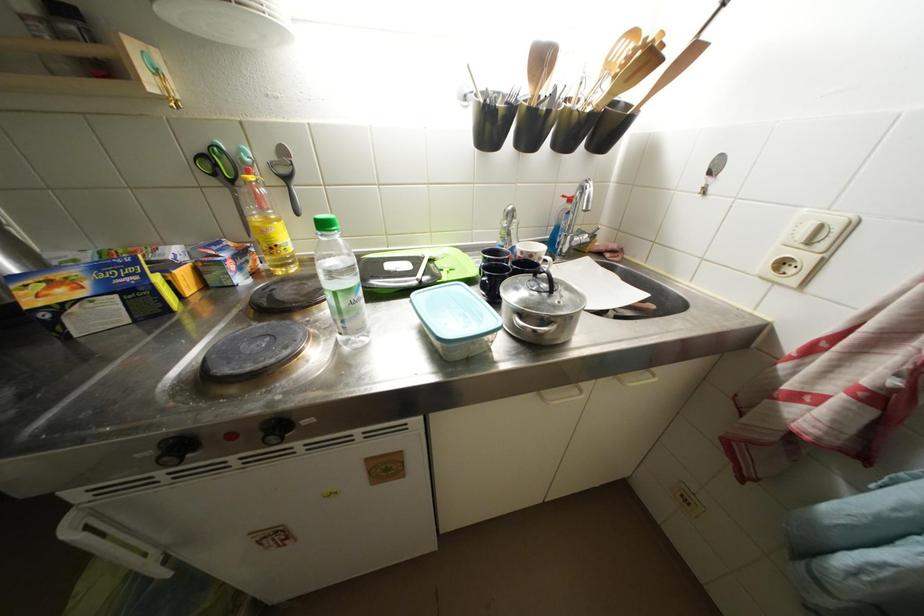
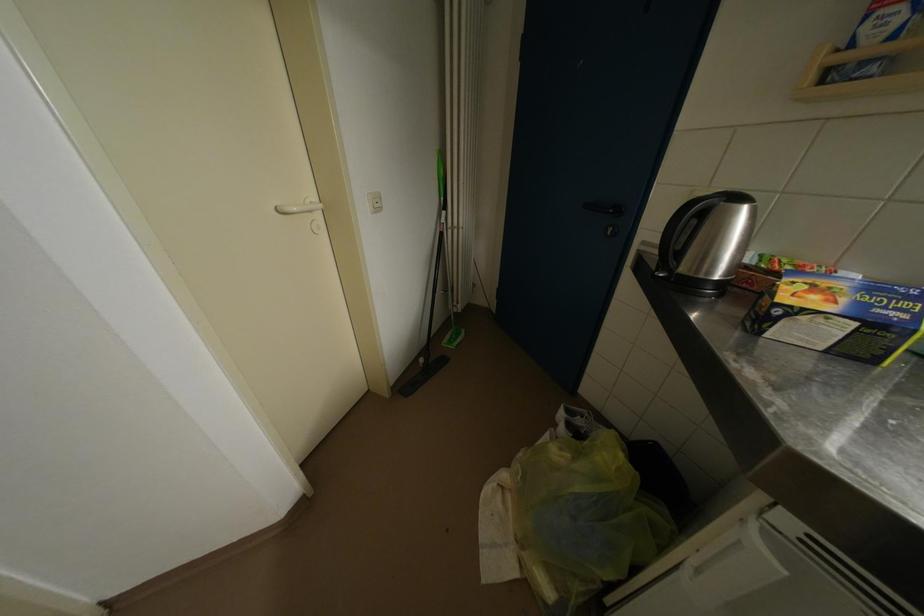
The first image is from the beginning of the video and the second image is from the end. How did the camera likely rotate when shooting the video?

The camera's rotation is toward left-down.